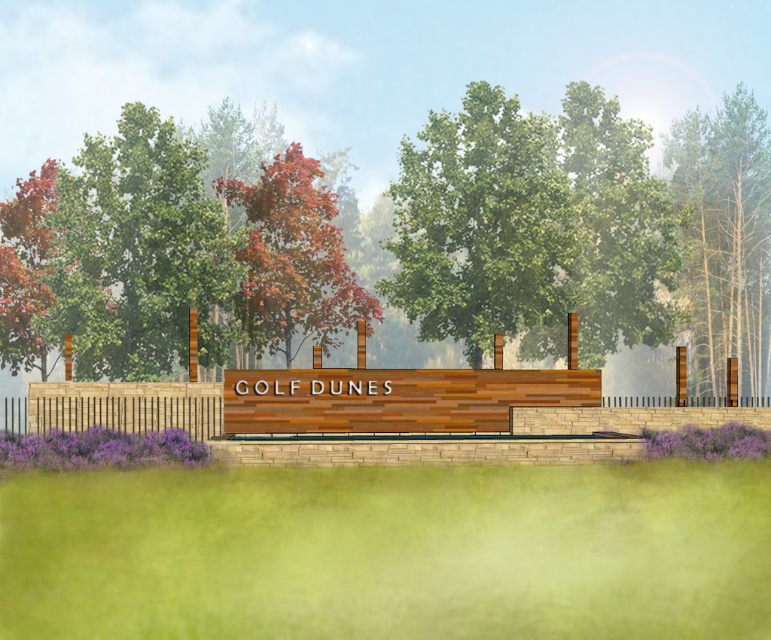
You are standing in front of the GOLF DUNES signboard and notice the brown textured wood at right. Where exactly is this brown textured wood positioned relative to the signboard?

The brown textured wood at right is located at point 0.369 along the horizontal axis and 0.940 along the vertical axis relative to the signboard.

You are standing in front of the GOLF DUNES signboard and want to take a photo of the green leafy tree at center. Where should you position yourself to capture the tree in the frame?

The green leafy tree at center is located at the coordinates 0.352 on the x axis and 0.625 on the y axis, so you should position yourself directly in front of the signboard to capture the tree in the center of the frame.

You are standing in front of the Golf Dunes signboard and notice two points marked on the image. The first point is at coordinate point (206, 244) and the second is at point (25, 426). Which point is closer to you?

Point (206, 244) is closer to you because it is further to the viewer than point (25, 426).